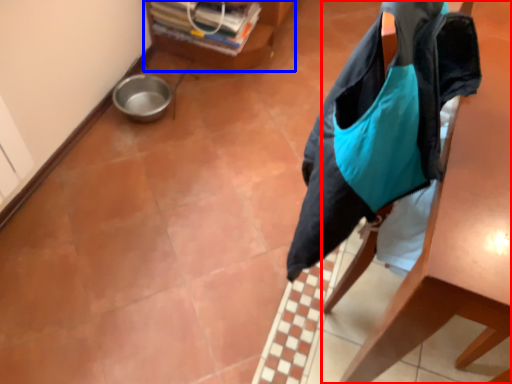
Question: Which point is further to the camera, furniture (highlighted by a red box) or furniture (highlighted by a blue box)?

Choices:
 (A) furniture
 (B) furniture

Answer: (B)